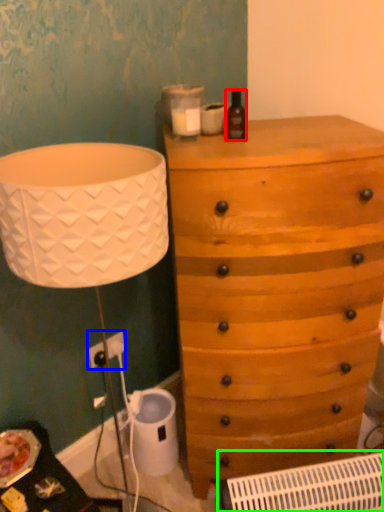
Question: Which object is the farthest from bottle (highlighted by a red box)? Choose among these: electric outlet (highlighted by a blue box) or air conditioning (highlighted by a green box).

Choices:
 (A) electric outlet
 (B) air conditioning

Answer: (B)